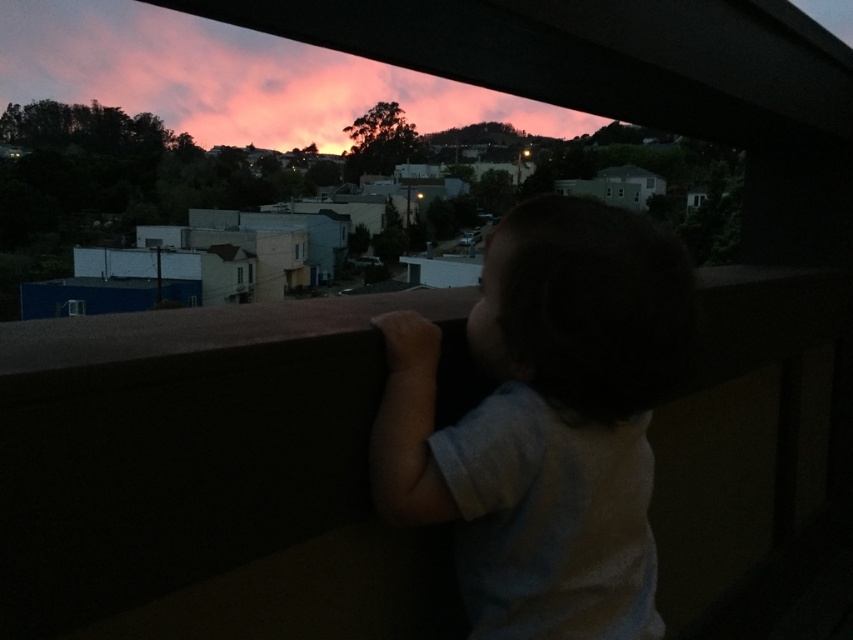
You are standing inside the building and looking through the dark wooden railing at the scene outside. You notice the white cotton shirt at center and the pink cotton candy clouds at upper center. Which object is closer to you?

The white cotton shirt at center is closer to you because it is shorter than the pink cotton candy clouds at upper center, indicating it is positioned in front.

You are an artist trying to sketch this scene. You want to ensure the proportions are accurate. Which object should you draw first, the white cotton shirt at center or the pink cotton candy clouds at upper center, if you want to start with the wider one?

You should start with the pink cotton candy clouds at upper center because its width is greater than the white cotton shirt at center.

You are standing inside the building looking out through the window. There is a point marked at coordinates point (618, 339). If you want to place a small plant pot exactly at that point on the railing, will it be possible to do so without the pot overhanging the edge of the railing?

The point (618, 339) is 1.39 meters from the viewer. Since the railing is dark wooden and frames the view, it is possible to place the plant pot at that point as long as the railing extends sufficiently beyond the marked point to support the pot without overhanging the edge. However, without knowing the railing width, we can only confirm the distance from the viewer.